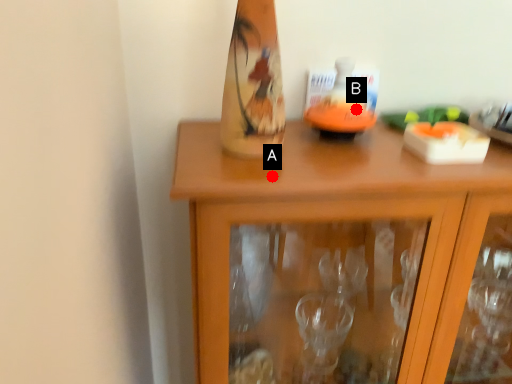
Question: Two points are circled on the image, labeled by A and B beside each circle. Which point is farther from the camera taking this photo?

Choices:
 (A) A is further
 (B) B is further

Answer: (B)